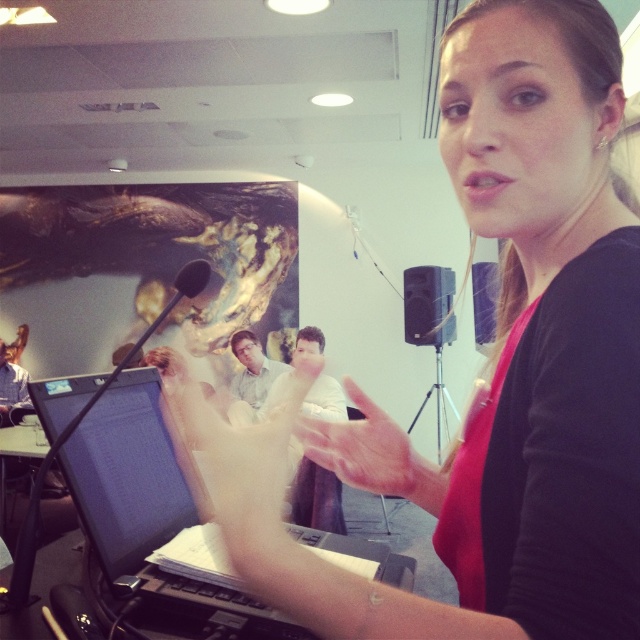
Based on the photo, what is the location of the point with coordinates (428, 305) in the image?

The point with coordinates (428, 305) is located on the matte black speaker at center.

You are standing in the conference room and want to move from point A to point B. Point A is at coordinate point (531, 67) and point B is at coordinate point (490, 316). Which point is closer to you when you first enter the room?

Point A at coordinate point (531, 67) is closer to the viewer than point B at coordinate point (490, 316), so point A is closer to you when you first enter the room.

You are a person who wants to reach the matte black speaker at center without touching the matte black laptop at center. How can you do this?

The matte black laptop at center is in front of the matte black speaker at center. To reach the speaker without touching the laptop, you can move around the sides or behind the laptop to access the speaker.